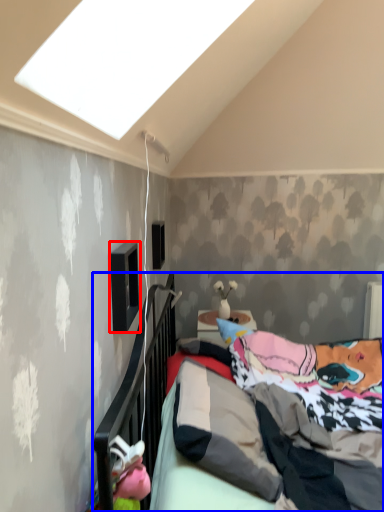
Question: Which of the following is the closest to the observer, window (highlighted by a red box) or bed (highlighted by a blue box)?

Choices:
 (A) window
 (B) bed

Answer: (B)